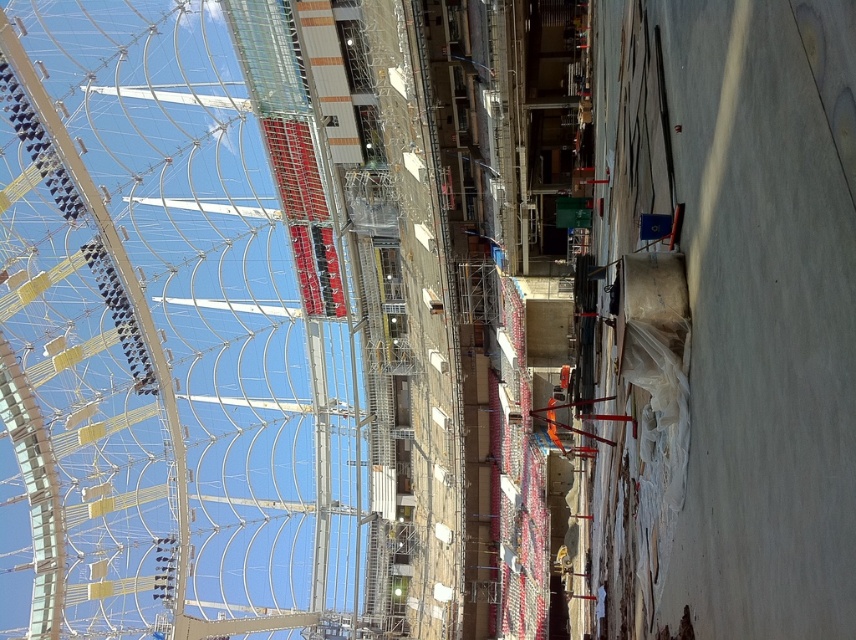
Question: Is metallic scaffolding at upper center positioned at the back of concrete slab at right?

Choices:
 (A) yes
 (B) no

Answer: (A)

Question: Can you confirm if metallic scaffolding at upper center is positioned below concrete slab at right?

Choices:
 (A) no
 (B) yes

Answer: (B)

Question: Does metallic scaffolding at upper center have a smaller size compared to concrete slab at right?

Choices:
 (A) yes
 (B) no

Answer: (B)

Question: Which object is farther from the camera taking this photo?

Choices:
 (A) metallic scaffolding at upper center
 (B) concrete slab at right

Answer: (A)